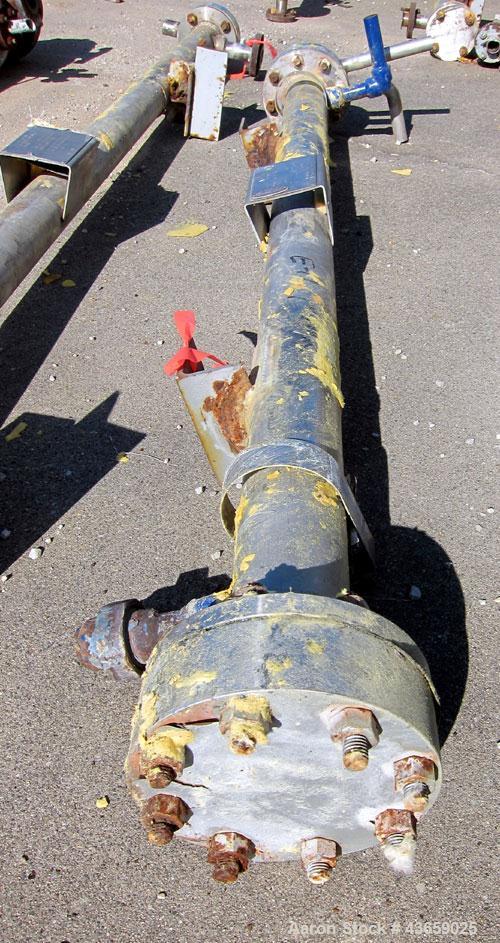
This screenshot has height=943, width=500. In order to click on metal brackets in this screenshot , I will do `click(294, 176)`, `click(68, 149)`, `click(275, 459)`.